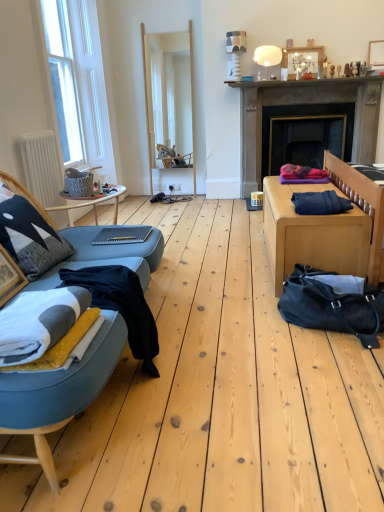
Question: From the image's perspective, does matte gray table at center, acting as the 2th table starting from the right, appear lower than knitted fabric pillow at left?

Choices:
 (A) no
 (B) yes

Answer: (A)

Question: Is matte gray table at center, acting as the 2th table starting from the right, to the right of knitted fabric pillow at left from the viewer's perspective?

Choices:
 (A) yes
 (B) no

Answer: (A)

Question: Is matte gray table at center, acting as the 2th table starting from the right, to the left of knitted fabric pillow at left from the viewer's perspective?

Choices:
 (A) yes
 (B) no

Answer: (B)

Question: Is matte gray table at center, which ranks as the first table in left-to-right order, behind knitted fabric pillow at left?

Choices:
 (A) yes
 (B) no

Answer: (A)

Question: From a real-world perspective, is matte gray table at center, which ranks as the first table in left-to-right order, located higher than knitted fabric pillow at left?

Choices:
 (A) no
 (B) yes

Answer: (A)

Question: Looking at their shapes, would you say dark blue fabric at right, positioned as the 1th clothing in back-to-front order, is wider or thinner than white fleece blanket at left?

Choices:
 (A) wide
 (B) thin

Answer: (A)

Question: Looking at the image, does dark blue fabric at right, which is the 2th clothing in front-to-back order, seem bigger or smaller compared to white fleece blanket at left?

Choices:
 (A) big
 (B) small

Answer: (B)

Question: Is point (349, 206) closer or farther from the camera than point (69, 325)?

Choices:
 (A) farther
 (B) closer

Answer: (A)

Question: Do you think dark blue fabric at right, positioned as the 1th clothing in back-to-front order, is within white fleece blanket at left, or outside of it?

Choices:
 (A) inside
 (B) outside

Answer: (B)

Question: Considering the positions of point (294, 308) and point (327, 206), is point (294, 308) closer or farther from the camera than point (327, 206)?

Choices:
 (A) farther
 (B) closer

Answer: (B)

Question: Is black leather duffel bag at lower right wider or thinner than dark blue fabric at right, the first clothing positioned from the top?

Choices:
 (A) wide
 (B) thin

Answer: (A)

Question: Choose the correct answer: Is black leather duffel bag at lower right inside dark blue fabric at right, arranged as the second clothing when viewed from the left, or outside it?

Choices:
 (A) inside
 (B) outside

Answer: (B)

Question: Is black leather duffel bag at lower right in front of or behind dark blue fabric at right, which is the 2th clothing in front-to-back order, in the image?

Choices:
 (A) front
 (B) behind

Answer: (A)

Question: Based on their sizes in the image, would you say dark blue fabric at right, positioned as the 1th clothing in back-to-front order, is bigger or smaller than wooden frame mirror at center?

Choices:
 (A) small
 (B) big

Answer: (A)

Question: Considering the positions of point (334, 207) and point (157, 100), is point (334, 207) closer or farther from the camera than point (157, 100)?

Choices:
 (A) farther
 (B) closer

Answer: (B)